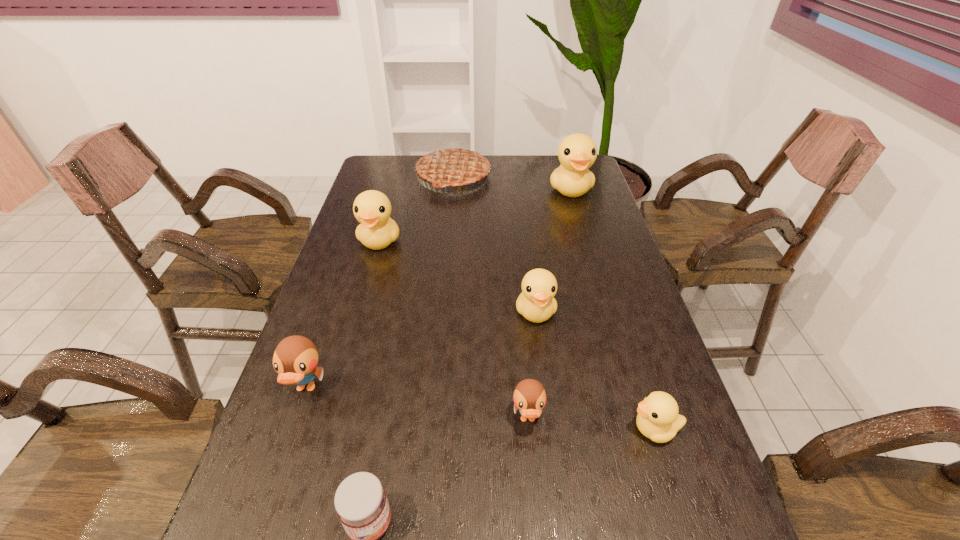
Where is `free spot located on the left of the pie`? The height and width of the screenshot is (540, 960). free spot located on the left of the pie is located at coordinates (369, 177).

You are a GUI agent. You are given a task and a screenshot of the screen. Output one action in this format:
    pyautogui.click(x=<x>, y=<y>)
    Task: Click on the vacant space located on the face of the biggest yellow duck
    Image resolution: width=960 pixels, height=540 pixels.
    Given the screenshot: What is the action you would take?
    pyautogui.click(x=589, y=252)

The image size is (960, 540). In order to click on blank space located on the face of the second farthest duck in this screenshot , I will do `click(354, 332)`.

What are the coordinates of `vacant space located 0.320m on the face of the second yellow duck from left to right` in the screenshot? It's located at (554, 456).

What are the coordinates of `vacant region located on the front-facing side of the bigger blue duck` in the screenshot? It's located at (271, 492).

I want to click on free region located 0.090m on the front-facing side of the smaller blue duck, so [x=534, y=482].

You are a GUI agent. You are given a task and a screenshot of the screen. Output one action in this format:
    pyautogui.click(x=<x>, y=<y>)
    Task: Click on the vacant region located 0.360m on the face of the nearest yellow duck
    Image resolution: width=960 pixels, height=540 pixels.
    Given the screenshot: What is the action you would take?
    pyautogui.click(x=454, y=429)

Find the location of a particular element. The width and height of the screenshot is (960, 540). blank space located on the face of the nearest yellow duck is located at coordinates (484, 429).

The height and width of the screenshot is (540, 960). In order to click on vacant space situated 0.340m on the face of the nearest yellow duck in this screenshot , I will do `click(465, 429)`.

Identify the location of pie located in the far edge section of the desktop. (455, 165).